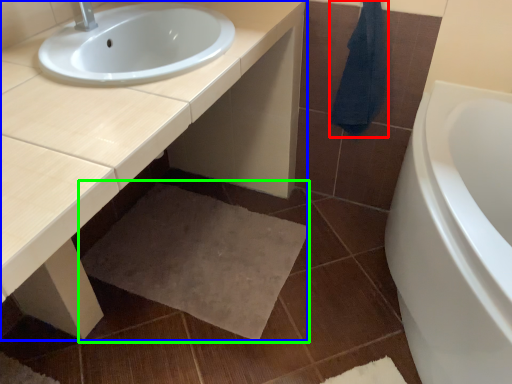
Question: Based on their relative distances, which object is nearer to bath towel (highlighted by a red box)? Choose from countertop (highlighted by a blue box) and bath mat (highlighted by a green box).

Choices:
 (A) countertop
 (B) bath mat

Answer: (A)